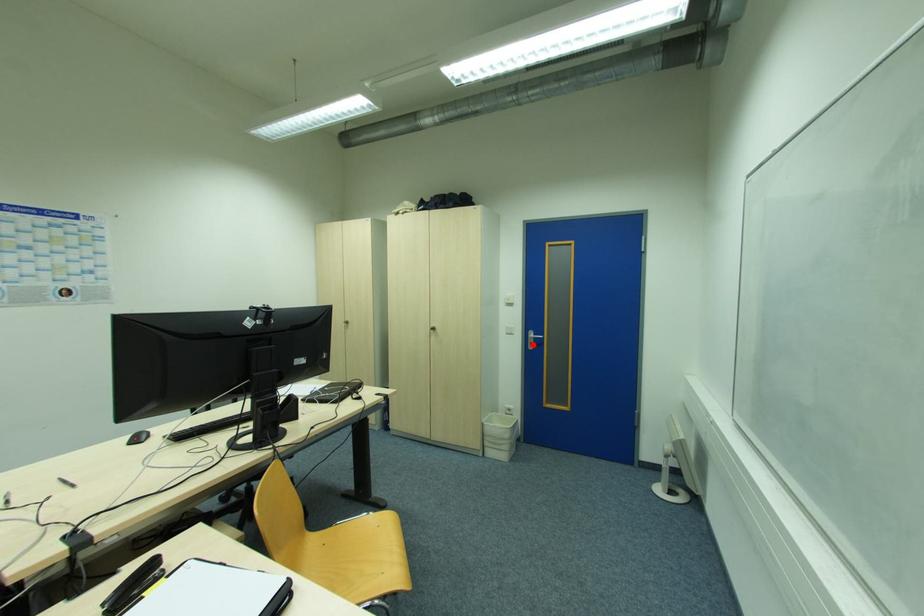
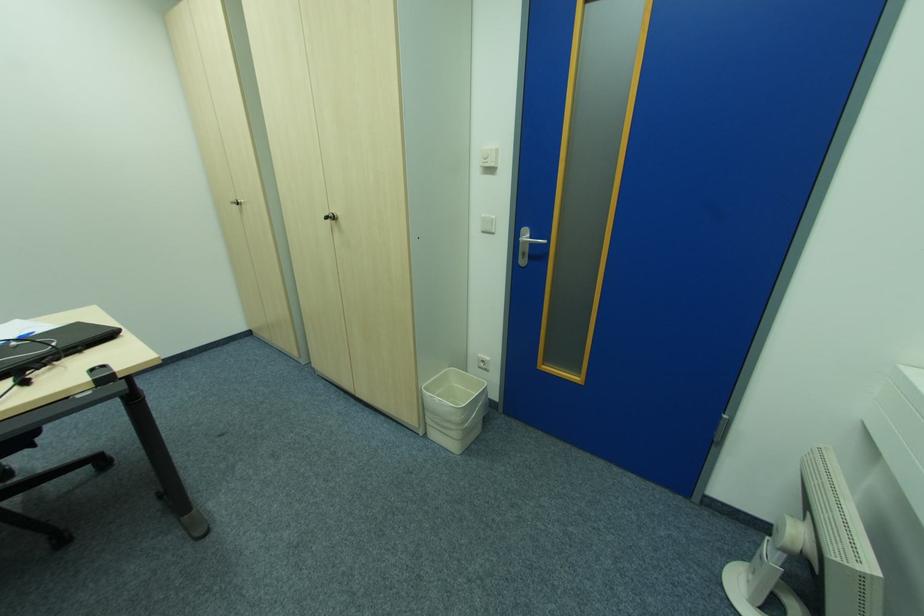
Locate, in the second image, the point that corresponds to the highlighted location in the first image.

(526, 256)